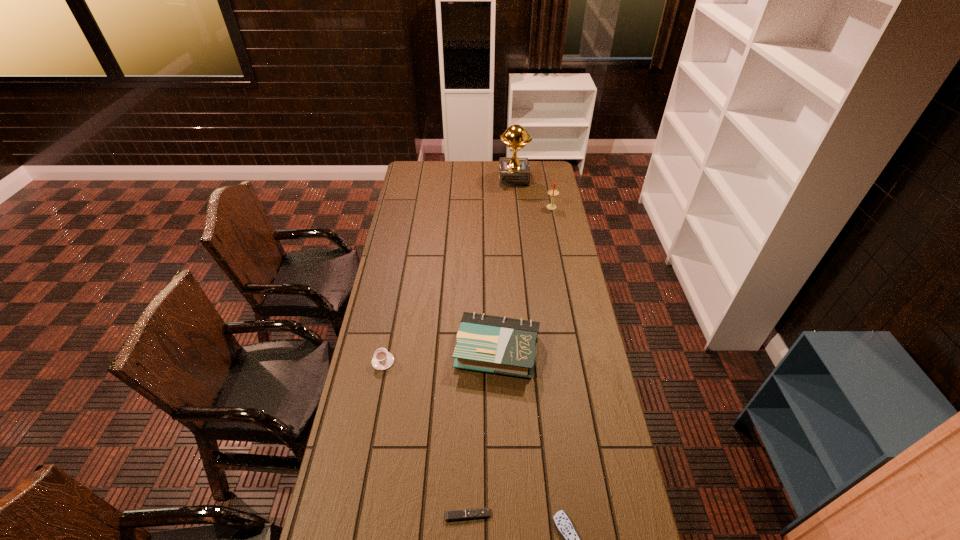
You are a GUI agent. You are given a task and a screenshot of the screen. Output one action in this format:
    pyautogui.click(x=<x>, y=<y>)
    Task: Click on the free space located 0.290m on the front-facing side of the tallest object
    
    Given the screenshot: What is the action you would take?
    pyautogui.click(x=448, y=179)

At what (x,y) coordinates should I click in order to perform the action: click on free space located 0.190m on the front-facing side of the tallest object. Please return your answer as a coordinate pair (x, y). The height and width of the screenshot is (540, 960). Looking at the image, I should click on (466, 179).

Find the location of a particular element. free spot located on the front of the candle is located at coordinates (561, 251).

The image size is (960, 540). What are the coordinates of `vacant region located 0.070m on the left of the paperback book` in the screenshot? It's located at (436, 351).

The width and height of the screenshot is (960, 540). Identify the location of free space located on the handle side of the leftmost object. (376, 395).

This screenshot has height=540, width=960. What are the coordinates of `free spot located 0.130m on the back of the shortest object` in the screenshot? It's located at (468, 463).

The image size is (960, 540). Find the location of `object located at the far edge`. object located at the far edge is located at coordinates (513, 171).

You are a GUI agent. You are given a task and a screenshot of the screen. Output one action in this format:
    pyautogui.click(x=<x>, y=<y>)
    Task: Click on the object situated at the left edge
    
    Given the screenshot: What is the action you would take?
    pyautogui.click(x=382, y=360)

Where is `award located at the right edge`? Image resolution: width=960 pixels, height=540 pixels. award located at the right edge is located at coordinates (513, 171).

At what (x,y) coordinates should I click in order to perform the action: click on candle located in the right edge section of the desktop. Please return your answer as a coordinate pair (x, y). The width and height of the screenshot is (960, 540). Looking at the image, I should click on (552, 192).